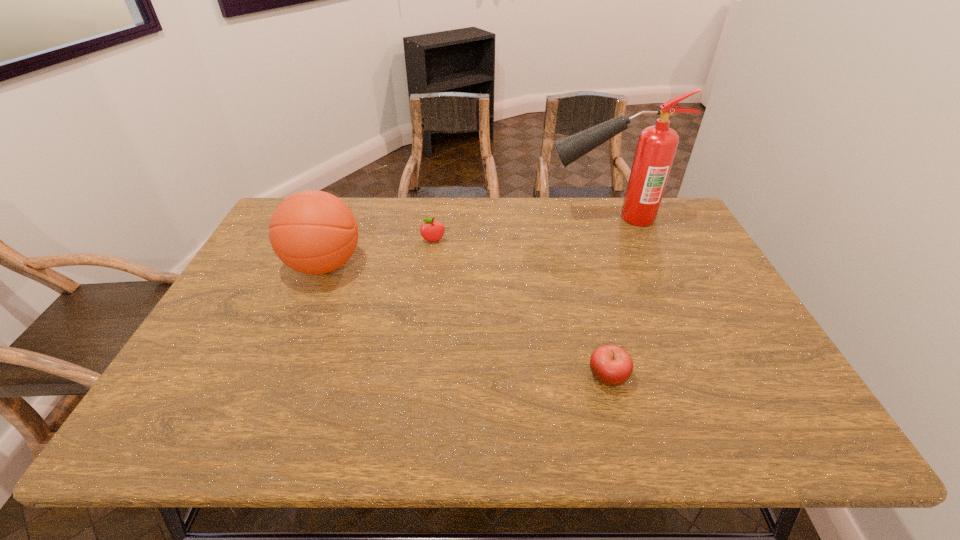
Identify the location of blank space located at the nozzle of the fire extinguisher. The width and height of the screenshot is (960, 540). (450, 218).

This screenshot has height=540, width=960. I want to click on vacant area situated on the right of the basketball, so [x=429, y=265].

What are the coordinates of `free location located on the right of the farther apple` in the screenshot? It's located at (478, 241).

I want to click on vacant space located on the right of the right apple, so click(672, 376).

Locate an element on the screen. object present at the far edge is located at coordinates (657, 145).

Locate an element on the screen. The image size is (960, 540). object at the left edge is located at coordinates (314, 232).

Where is `object at the right edge`? object at the right edge is located at coordinates (657, 145).

Find the location of a particular element. object located in the far right corner section of the desktop is located at coordinates (657, 145).

The width and height of the screenshot is (960, 540). Find the location of `vacant region at the far edge`. vacant region at the far edge is located at coordinates (527, 235).

The width and height of the screenshot is (960, 540). In the image, there is a desktop. What are the coordinates of `free space at the near edge` in the screenshot? It's located at (656, 435).